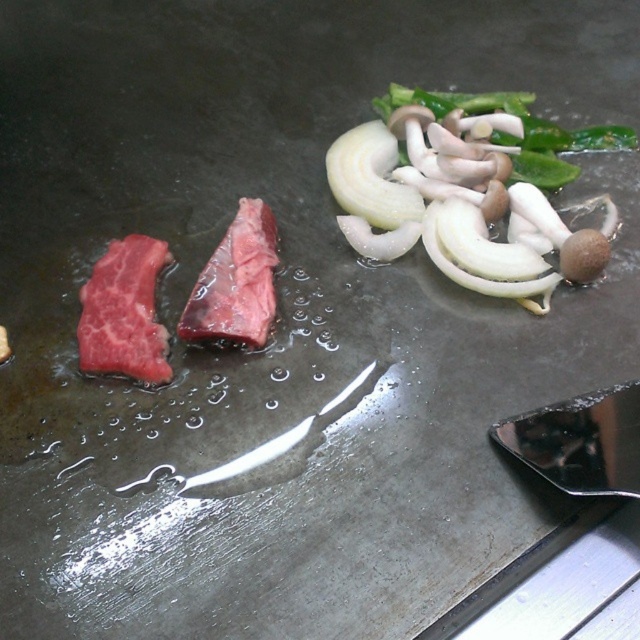
Question: Does red raw steak at left have a larger size compared to pink raw steak at center?

Choices:
 (A) no
 (B) yes

Answer: (A)

Question: Which point is closer to the camera?

Choices:
 (A) white translucent onion at upper right
 (B) pink raw steak at center
 (C) red raw steak at left

Answer: (C)

Question: Is white translucent onion at upper right below pink raw steak at center?

Choices:
 (A) yes
 (B) no

Answer: (B)

Question: Does white translucent onion at upper right have a larger size compared to red raw steak at left?

Choices:
 (A) no
 (B) yes

Answer: (B)

Question: Which object is farther from the camera taking this photo?

Choices:
 (A) red raw steak at left
 (B) white translucent onion at upper right
 (C) pink raw steak at center

Answer: (B)

Question: Among these objects, which one is farthest from the camera?

Choices:
 (A) red raw steak at left
 (B) white translucent onion at upper right

Answer: (B)